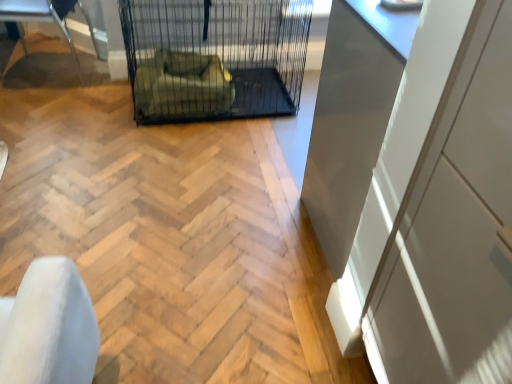
The width and height of the screenshot is (512, 384). Find the location of `vacant area situated below metallic silver chair at left (from a real-world perspective)`. vacant area situated below metallic silver chair at left (from a real-world perspective) is located at coordinates (60, 67).